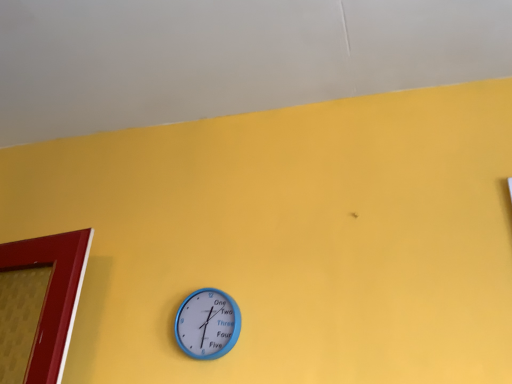
Question: Visually, is blue plastic wall clock at center positioned to the left or to the right of yellow matte wall at upper center?

Choices:
 (A) right
 (B) left

Answer: (A)

Question: From a real-world perspective, is blue plastic wall clock at center physically located above or below yellow matte wall at upper center?

Choices:
 (A) below
 (B) above

Answer: (A)

Question: In terms of height, does blue plastic wall clock at center look taller or shorter compared to yellow matte wall at upper center?

Choices:
 (A) tall
 (B) short

Answer: (A)

Question: Is yellow matte wall at upper center taller or shorter than blue plastic wall clock at center?

Choices:
 (A) short
 (B) tall

Answer: (A)

Question: Is yellow matte wall at upper center in front of or behind blue plastic wall clock at center in the image?

Choices:
 (A) behind
 (B) front

Answer: (B)

Question: Is point (57, 3) closer or farther from the camera than point (182, 347)?

Choices:
 (A) farther
 (B) closer

Answer: (B)

Question: From the image's perspective, is yellow matte wall at upper center above or below blue plastic wall clock at center?

Choices:
 (A) below
 (B) above

Answer: (B)